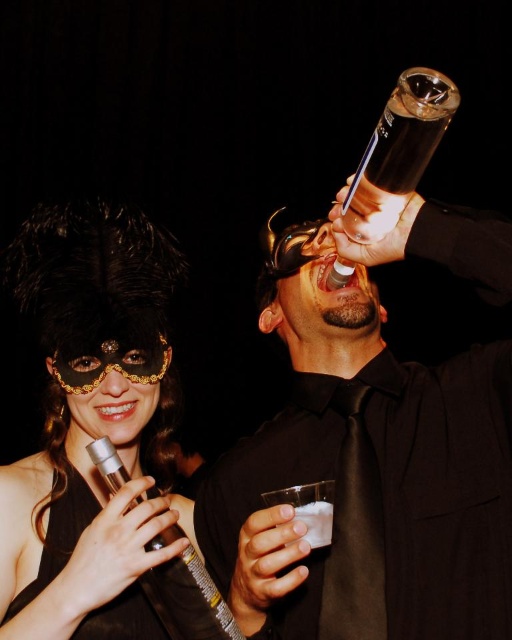
Question: Is shiny black bottle at upper center smaller than matte black mask at upper left?

Choices:
 (A) no
 (B) yes

Answer: (B)

Question: Does black satin tie at center come in front of clear glass at upper center?

Choices:
 (A) no
 (B) yes

Answer: (A)

Question: Does shiny black bottle at upper center appear on the left side of black satin tie at center?

Choices:
 (A) no
 (B) yes

Answer: (B)

Question: Considering the real-world distances, which object is closest to the matte black mask at upper left?

Choices:
 (A) black satin tie at center
 (B) silver metallic microphone at lower left
 (C) shiny black bottle at upper center

Answer: (B)

Question: Which point is closer to the camera taking this photo?

Choices:
 (A) (323, 518)
 (B) (194, 564)

Answer: (A)

Question: Which point is closer to the camera?

Choices:
 (A) clear glass at upper center
 (B) silver metallic microphone at lower left

Answer: (A)